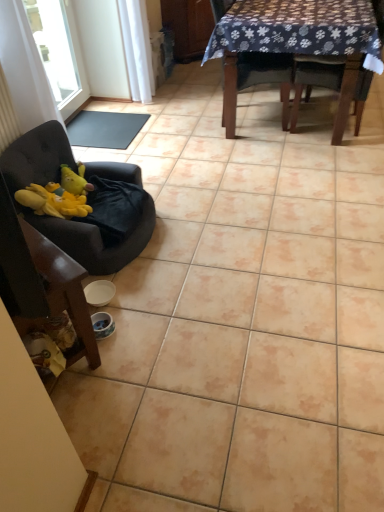
Question: Is dark fabric chair at upper right, arranged as the fourth chair when viewed from the left, taller than yellow plush at left?

Choices:
 (A) yes
 (B) no

Answer: (A)

Question: Can yellow plush at left be found inside dark fabric chair at upper right, arranged as the fourth chair when viewed from the left?

Choices:
 (A) no
 (B) yes

Answer: (A)

Question: Is dark fabric chair at upper right, the 1th chair in the right-to-left sequence, facing towards yellow plush at left?

Choices:
 (A) yes
 (B) no

Answer: (B)

Question: Is dark fabric chair at upper right, the 1th chair in the right-to-left sequence, to the right of yellow plush at left from the viewer's perspective?

Choices:
 (A) yes
 (B) no

Answer: (A)

Question: Can you confirm if dark fabric chair at upper right, arranged as the fourth chair when viewed from the left, is thinner than yellow plush at left?

Choices:
 (A) no
 (B) yes

Answer: (A)

Question: From the image's perspective, does dark fabric chair at upper right, the 1th chair in the right-to-left sequence, appear higher than yellow plush at left?

Choices:
 (A) no
 (B) yes

Answer: (B)

Question: From a real-world perspective, is velvet dark brown armchair at left, placed as the first chair when sorted from left to right, on yellow plush at left?

Choices:
 (A) yes
 (B) no

Answer: (B)

Question: From the image's perspective, would you say velvet dark brown armchair at left, acting as the 4th chair starting from the right, is shown under yellow plush at left?

Choices:
 (A) no
 (B) yes

Answer: (B)

Question: Is velvet dark brown armchair at left, acting as the 4th chair starting from the right, outside of yellow plush at left?

Choices:
 (A) no
 (B) yes

Answer: (B)

Question: Is velvet dark brown armchair at left, acting as the 4th chair starting from the right, oriented away from yellow plush at left?

Choices:
 (A) yes
 (B) no

Answer: (B)

Question: Is velvet dark brown armchair at left, placed as the first chair when sorted from left to right, bigger than yellow plush at left?

Choices:
 (A) yes
 (B) no

Answer: (A)

Question: Does velvet dark brown armchair at left, placed as the first chair when sorted from left to right, have a greater height compared to yellow plush at left?

Choices:
 (A) no
 (B) yes

Answer: (B)

Question: From the image's perspective, does transparent glass window at upper left appear higher than wooden chair at upper right, which is counted as the 3th chair, starting from the left?

Choices:
 (A) yes
 (B) no

Answer: (A)